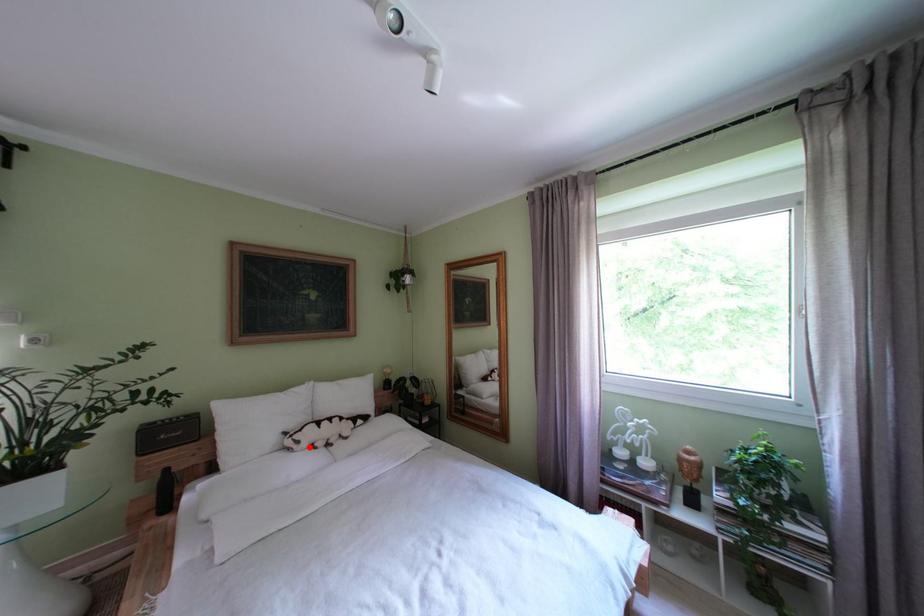
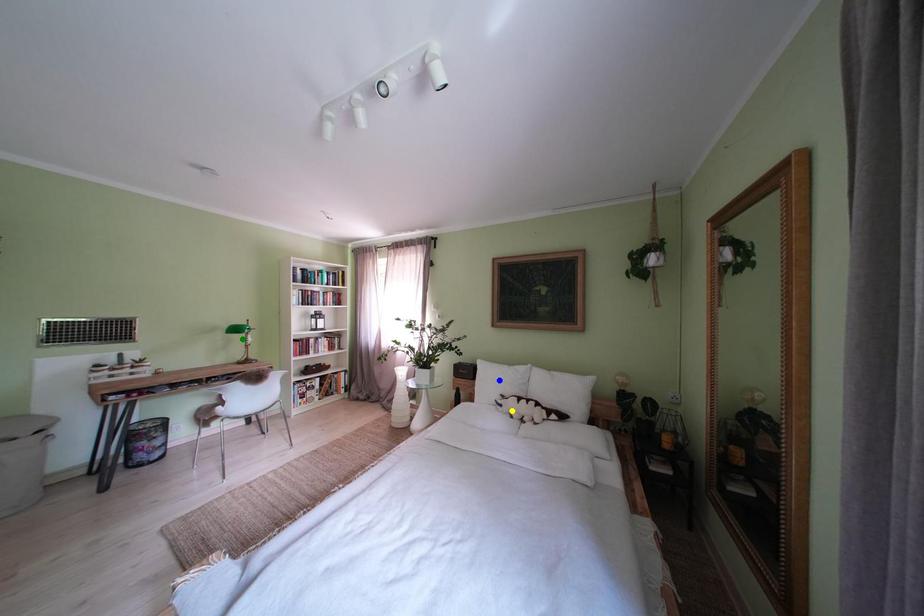
Question: I am providing you with two images of the same scene from different viewpoints. A red point is marked on the first image. You are given multiple points on the second image. Can you choose the point in image 2 that corresponds to the point in image 1?

Choices:
 (A) blue point
 (B) green point
 (C) yellow point

Answer: (C)